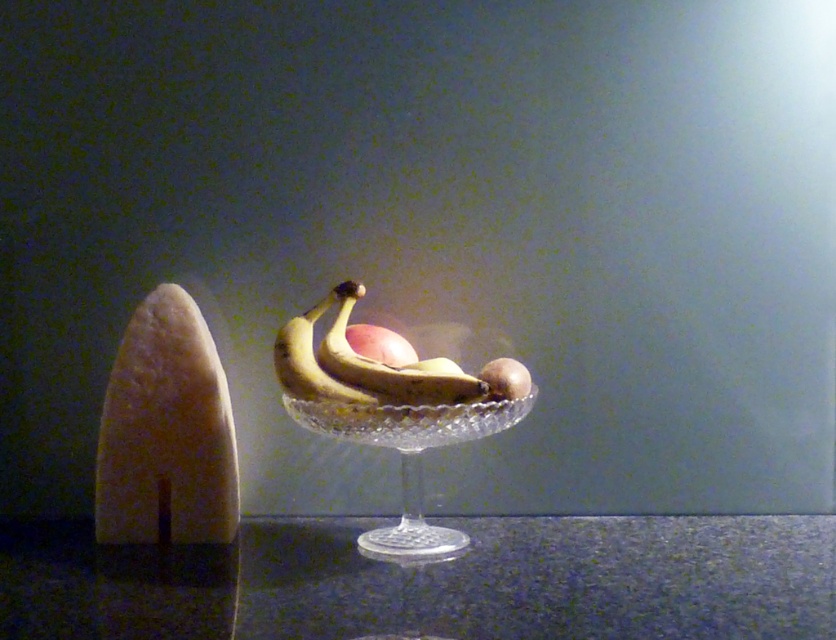
Question: Which is nearer to the clear glass bowl at center?

Choices:
 (A) glossy apple at center
 (B) granite table at center
 (C) smooth brown potato at center

Answer: (C)

Question: Which point appears closest to the camera in this image?

Choices:
 (A) (330, 348)
 (B) (580, 605)

Answer: (B)

Question: Is clear glass bowl at center below yellow matte bananas at center?

Choices:
 (A) yes
 (B) no

Answer: (A)

Question: Among these points, which one is nearest to the camera?

Choices:
 (A) (329, 400)
 (B) (307, 401)
 (C) (798, 625)

Answer: (C)

Question: Is clear glass bowl at center above glossy apple at center?

Choices:
 (A) yes
 (B) no

Answer: (B)

Question: Does clear glass bowl at center lie in front of glossy apple at center?

Choices:
 (A) no
 (B) yes

Answer: (B)